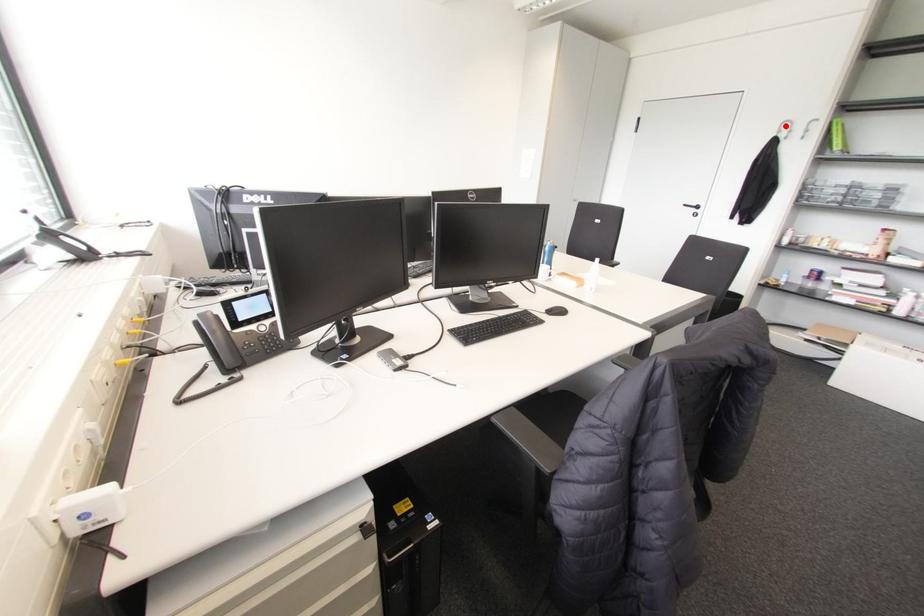
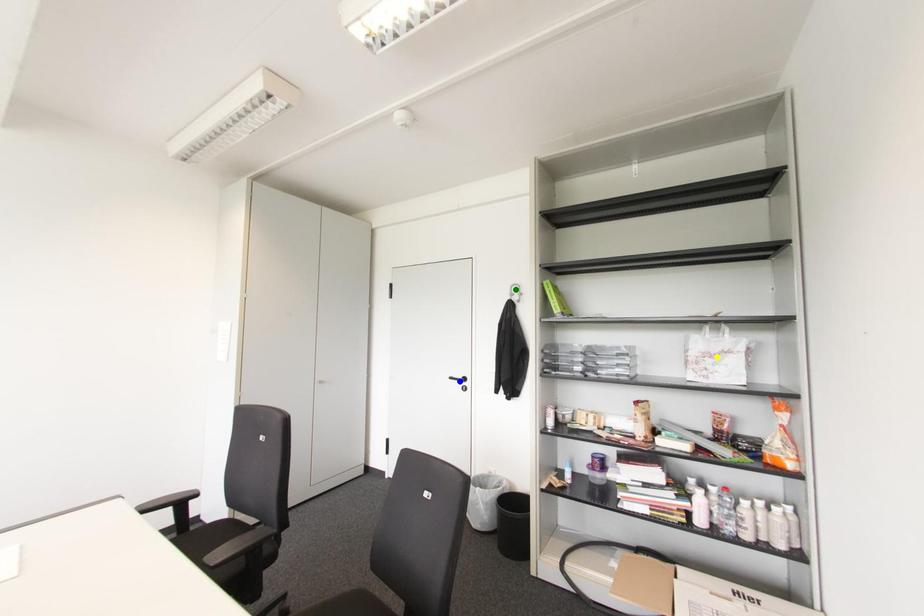
Question: I am providing you with two images of the same scene from different viewpoints. A red point is marked on the first image. You are given multiple points on the second image. Can you choose the point in image 2 that corresponds to the point in image 1?

Choices:
 (A) yellow point
 (B) green point
 (C) blue point

Answer: (B)